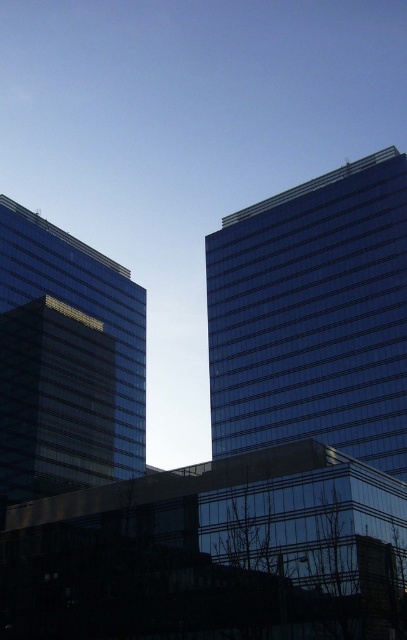
Question: Which object is closer to the camera taking this photo?

Choices:
 (A) shiny glass building at right
 (B) transparent glass building at left

Answer: (A)

Question: Does shiny glass building at right have a larger size compared to transparent glass building at left?

Choices:
 (A) no
 (B) yes

Answer: (B)

Question: In this image, where is shiny glass building at right located relative to transparent glass building at left?

Choices:
 (A) right
 (B) left

Answer: (A)

Question: Is shiny glass building at right smaller than transparent glass building at left?

Choices:
 (A) no
 (B) yes

Answer: (A)

Question: Among these points, which one is nearest to the camera?

Choices:
 (A) (229, 419)
 (B) (35, 362)

Answer: (B)